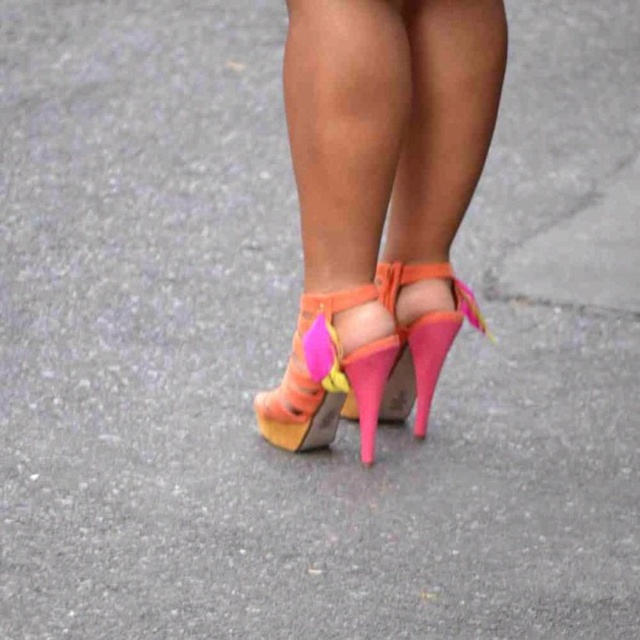
Question: Which object appears closest to the camera in this image?

Choices:
 (A) neon pink leather high heels at center
 (B) pink suede sandal at center

Answer: (A)

Question: Is neon pink leather high heels at center smaller than pink suede sandal at center?

Choices:
 (A) no
 (B) yes

Answer: (A)

Question: Based on their relative distances, which object is nearer to the neon pink leather high heels at center?

Choices:
 (A) pink suede sandal at center
 (B) neon pink leather high-heeled sandal at center

Answer: (A)

Question: Is neon pink leather high heels at center to the left of neon pink leather high-heeled sandal at center from the viewer's perspective?

Choices:
 (A) no
 (B) yes

Answer: (B)

Question: Which point is farther to the camera?

Choices:
 (A) neon pink leather high heels at center
 (B) neon pink leather high-heeled sandal at center

Answer: (B)

Question: Is pink suede sandal at center smaller than neon pink leather high-heeled sandal at center?

Choices:
 (A) no
 (B) yes

Answer: (A)